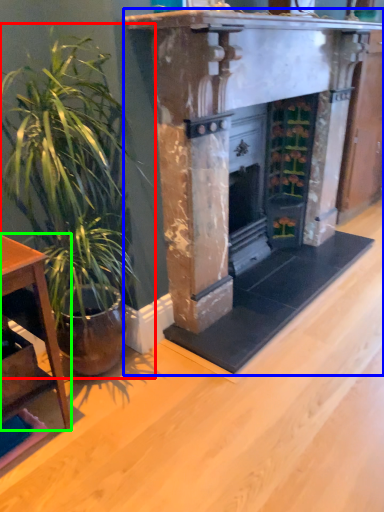
Question: Which is nearer to the houseplant (highlighted by a red box)? fireplace (highlighted by a blue box) or table (highlighted by a green box).

Choices:
 (A) fireplace
 (B) table

Answer: (B)